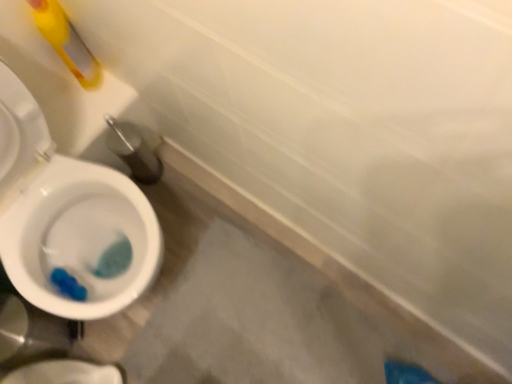
What do you see at coordinates (66, 41) in the screenshot? The height and width of the screenshot is (384, 512). I see `yellow plastic brush at upper left` at bounding box center [66, 41].

Where is `yellow plastic brush at upper left`? The image size is (512, 384). yellow plastic brush at upper left is located at coordinates (66, 41).

Measure the distance between yellow plastic brush at upper left and camera.

yellow plastic brush at upper left is 1.06 meters from camera.

I want to click on yellow plastic brush at upper left, so click(x=66, y=41).